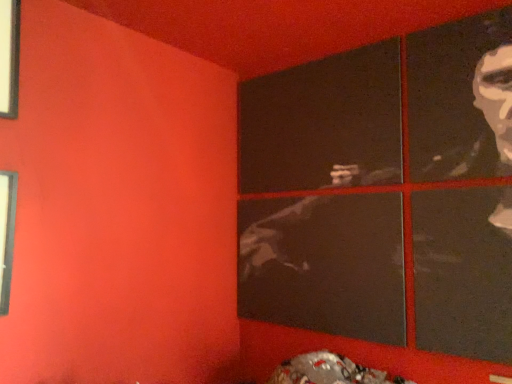
This screenshot has width=512, height=384. Find the location of `smooth black portrait at center`. smooth black portrait at center is located at coordinates (324, 264).

What do you see at coordinates (324, 264) in the screenshot?
I see `smooth black portrait at center` at bounding box center [324, 264].

In order to face smooth black portrait at center, should I rotate leftwards or rightwards?

A 7.456 degree turn to the right will do.

Where is `smooth black portrait at center`? smooth black portrait at center is located at coordinates (324, 264).